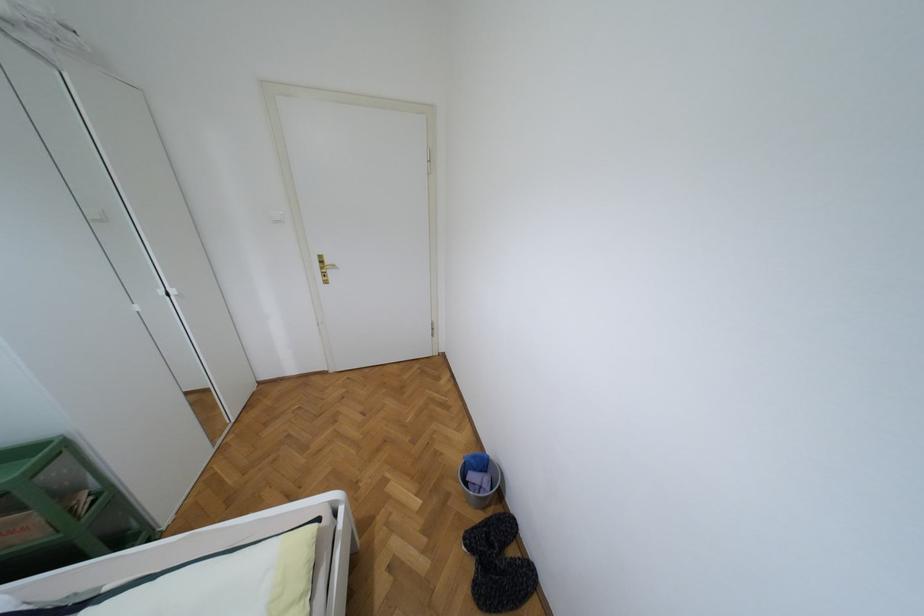
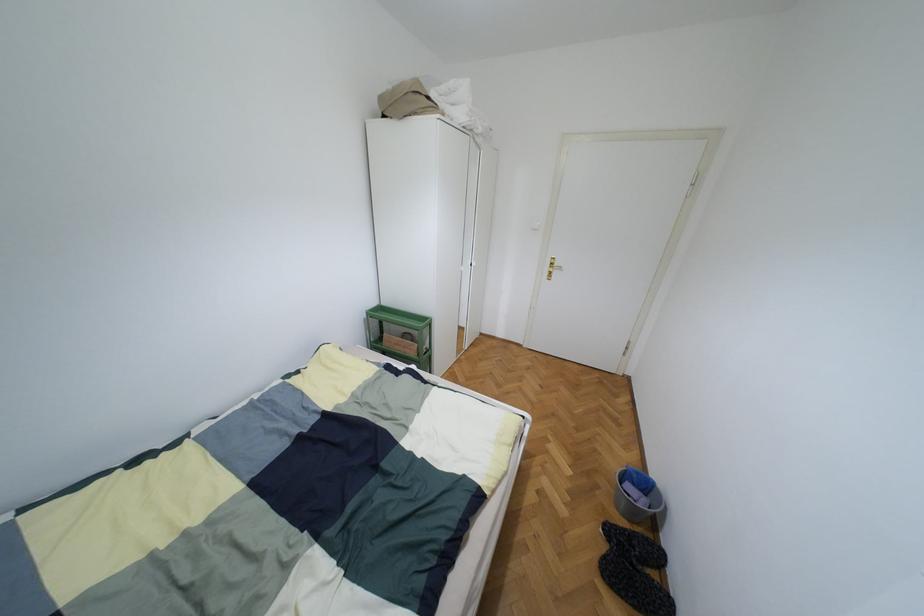
The point at (473, 456) is marked in the first image. Where is the corresponding point in the second image?

(638, 472)